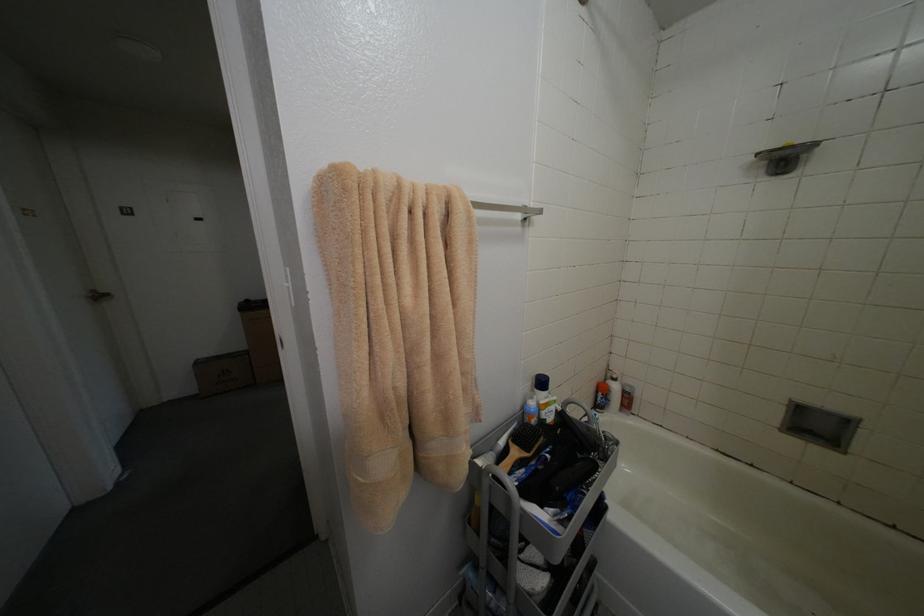
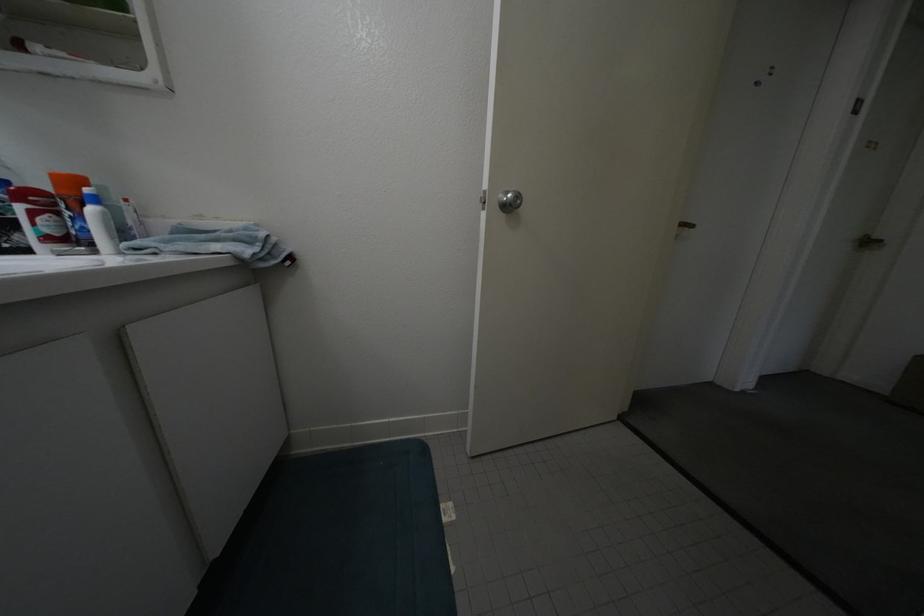
The images are taken continuously from a first-person perspective. In which direction is your viewpoint rotating?

The rotation direction of the camera is left-down.